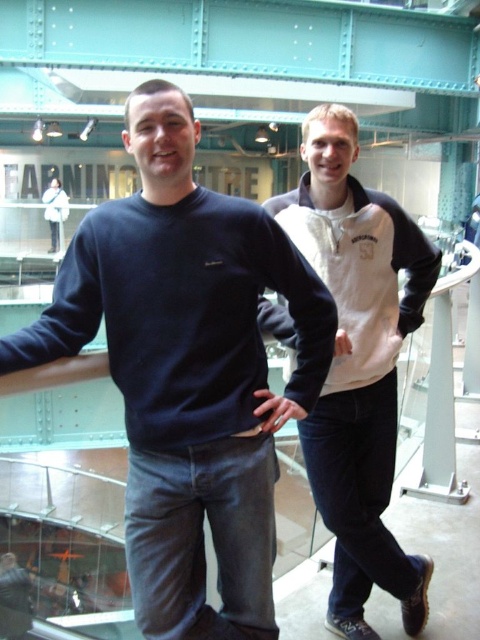
You are standing at the glass floor looking towards the center of the room. You need to reach either the white fleece sweatshirt at right or the matte black sweater at center. Which one is closer to you?

The matte black sweater at center is closer to you since it is positioned at the center of the room compared to the white fleece sweatshirt at right which is further away.

You are trying to decide which of the two people in the image is wearing a narrower garment. Both are standing at center. The dark blue cotton sweatshirt at center and the matte black sweater at center are visible. Which one has a narrower width?

The dark blue cotton sweatshirt at center has a narrower width than the matte black sweater at center according to the description.

You are navigating through the industrial space and need to reach a point closer to you. Which of the two points, point (156, 232) or point (124, 346), should you head towards?

Point (156, 232) is closer to the viewer than point (124, 346), so you should head towards point (156, 232).